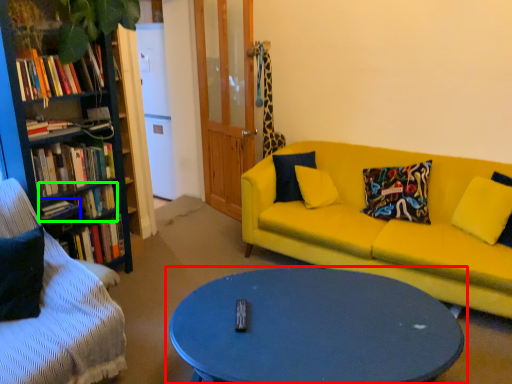
Question: Which object is the closest to the coffee table (highlighted by a red box)? Choose among these: book (highlighted by a blue box) or book (highlighted by a green box).

Choices:
 (A) book
 (B) book

Answer: (B)